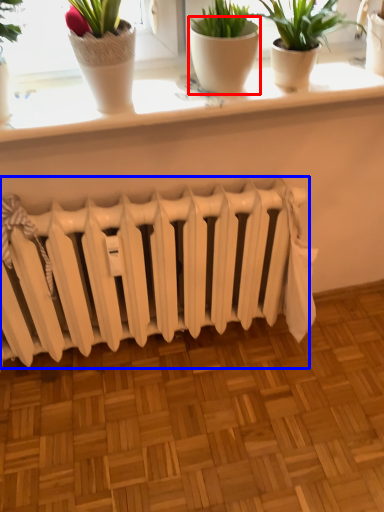
Question: Among these objects, which one is farthest to the camera, flowerpot (highlighted by a red box) or radiator (highlighted by a blue box)?

Choices:
 (A) flowerpot
 (B) radiator

Answer: (B)